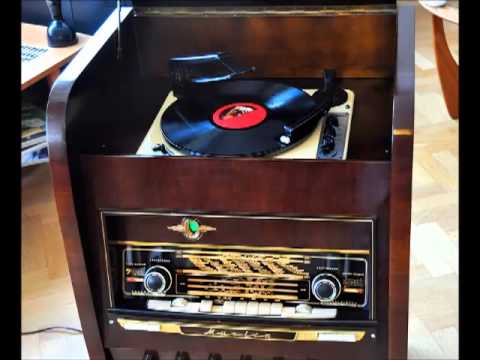
At what (x,y) coordinates should I click in order to perform the action: click on floor to right of record player. Please return your answer as a coordinate pair (x, y). The height and width of the screenshot is (360, 480). Looking at the image, I should click on (434, 209).